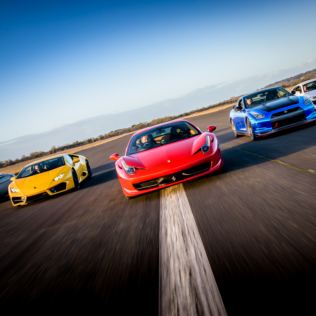
This screenshot has width=316, height=316. I want to click on mirrors, so click(11, 177), click(79, 158), click(112, 157), click(211, 126), click(239, 107), click(294, 90).